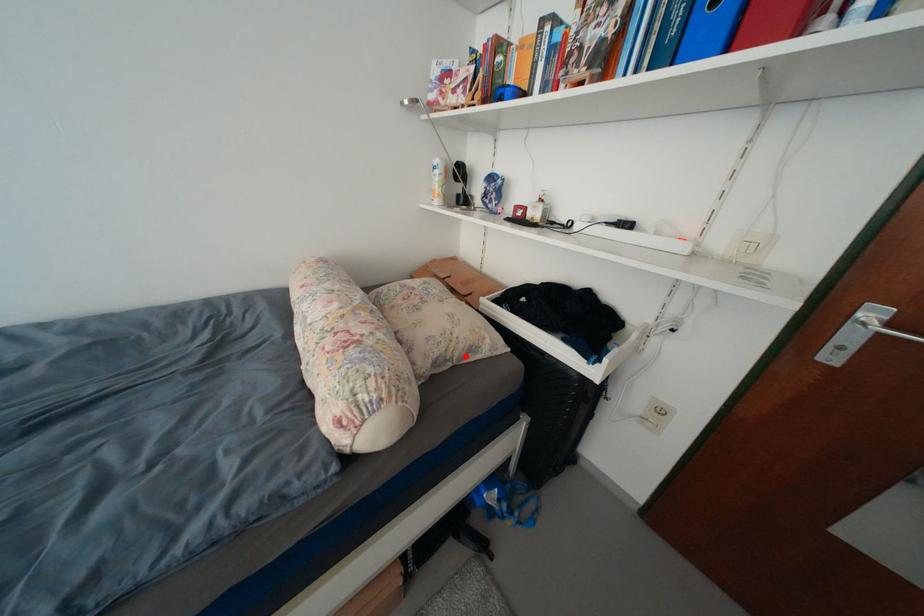
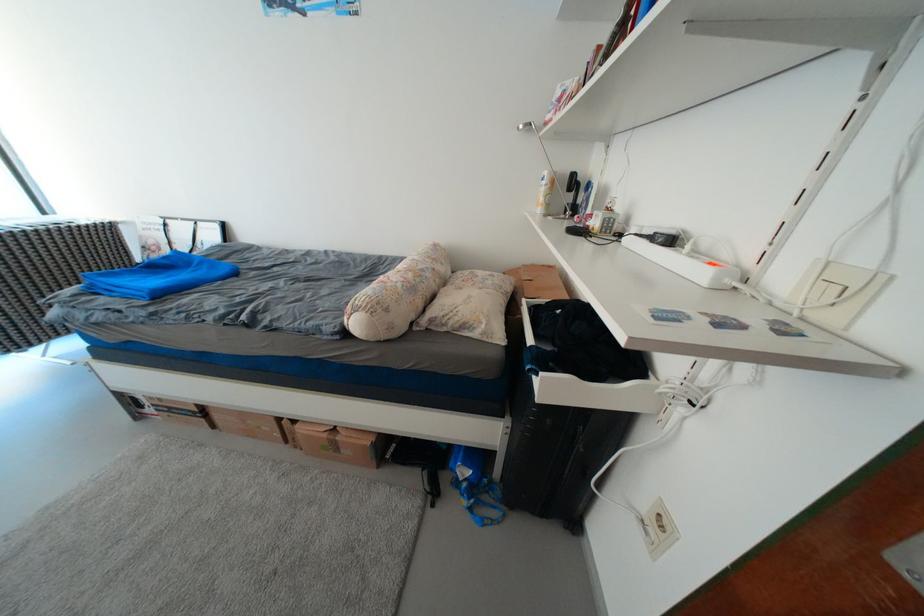
Locate, in the second image, the point that corresponds to the highlighted location in the first image.

(459, 325)